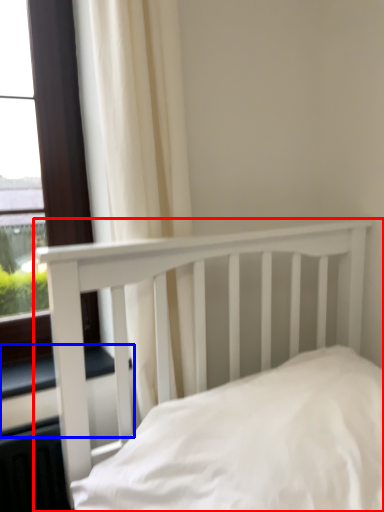
Question: Among these objects, which one is farthest to the camera, bed (highlighted by a red box) or window sill (highlighted by a blue box)?

Choices:
 (A) bed
 (B) window sill

Answer: (B)